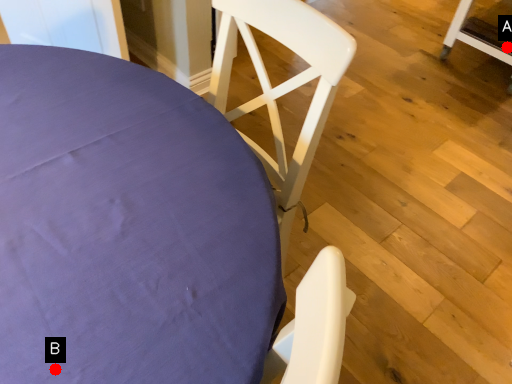
Question: Two points are circled on the image, labeled by A and B beside each circle. Which of the following is the farthest from the observer?

Choices:
 (A) A is further
 (B) B is further

Answer: (A)